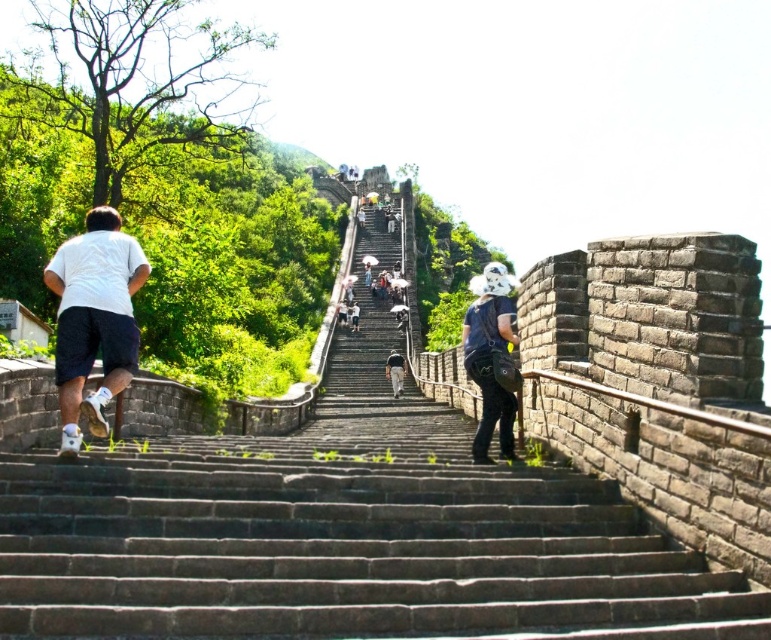
Can you confirm if white matte shorts at left is taller than dark blue denim overalls at center?

Yes.

This screenshot has width=771, height=640. In order to click on white matte shorts at left in this screenshot , I will do `click(93, 317)`.

Does dark gray stone stairs at center lie in front of dark blue denim overalls at center?

That is True.

Does point (173, 504) come closer to viewer compared to point (480, 353)?

Yes, it is in front of point (480, 353).

At what (x,y) coordinates should I click in order to perform the action: click on dark gray stone stairs at center. Please return your answer as a coordinate pair (x, y). This screenshot has height=640, width=771. Looking at the image, I should click on (339, 548).

Which is more to the right, dark gray stone stairs at center or white matte shorts at left?

From the viewer's perspective, dark gray stone stairs at center appears more on the right side.

Does point (347, 467) lie in front of point (56, 264)?

Yes, point (347, 467) is closer to viewer.

Locate an element on the screen. This screenshot has height=640, width=771. dark gray stone stairs at center is located at coordinates (339, 548).